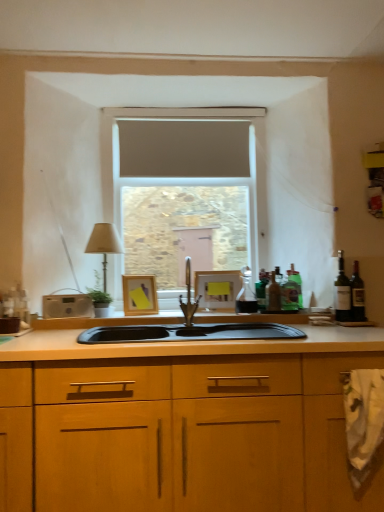
Locate an element on the screen. This screenshot has width=384, height=512. free region on the left part of translucent glass bottle at right, placed as the second bottle when sorted from left to right is located at coordinates (254, 311).